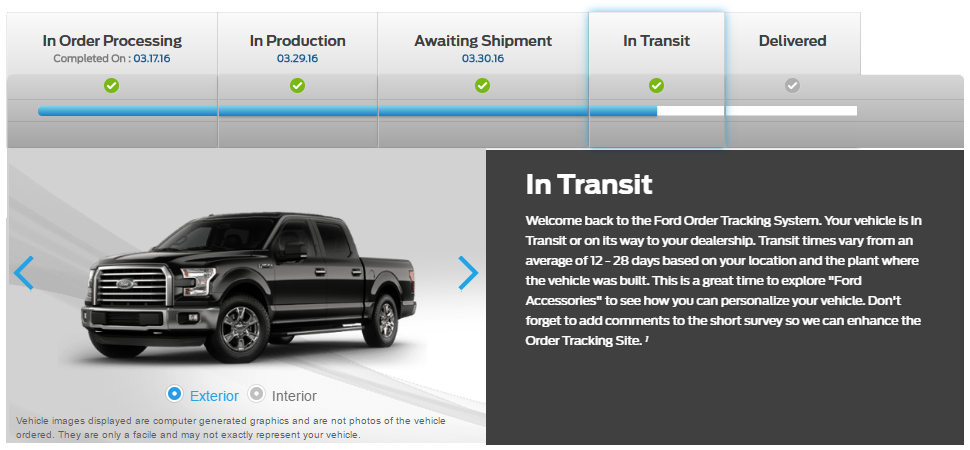
Locate an element on the screen. right mirror is located at coordinates (299, 251).